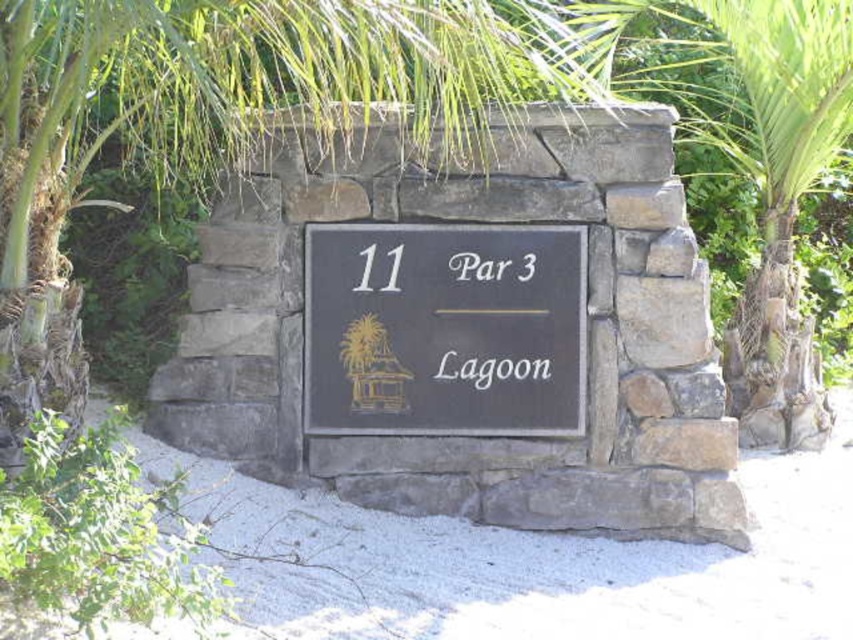
Question: Which object is positioned closest to the black matte sign at center?

Choices:
 (A) black slate sign at center
 (B) green leafy palm tree at upper center

Answer: (A)

Question: Can you confirm if green leafy palm tree at upper center is thinner than black matte sign at center?

Choices:
 (A) no
 (B) yes

Answer: (A)

Question: Does green leafy palm tree at upper center appear under black matte sign at center?

Choices:
 (A) yes
 (B) no

Answer: (B)

Question: Which point is closer to the camera?

Choices:
 (A) (575, 252)
 (B) (6, 348)

Answer: (B)

Question: Is the position of green leafy palm tree at upper center more distant than that of black slate sign at center?

Choices:
 (A) no
 (B) yes

Answer: (A)

Question: Among these objects, which one is nearest to the camera?

Choices:
 (A) black matte sign at center
 (B) black slate sign at center
 (C) green leafy palm tree at upper center

Answer: (C)